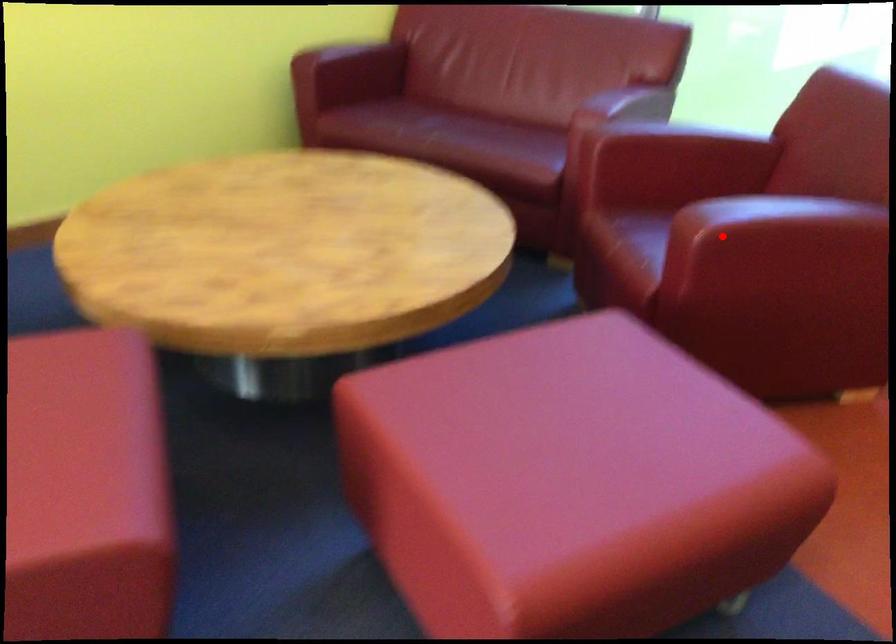
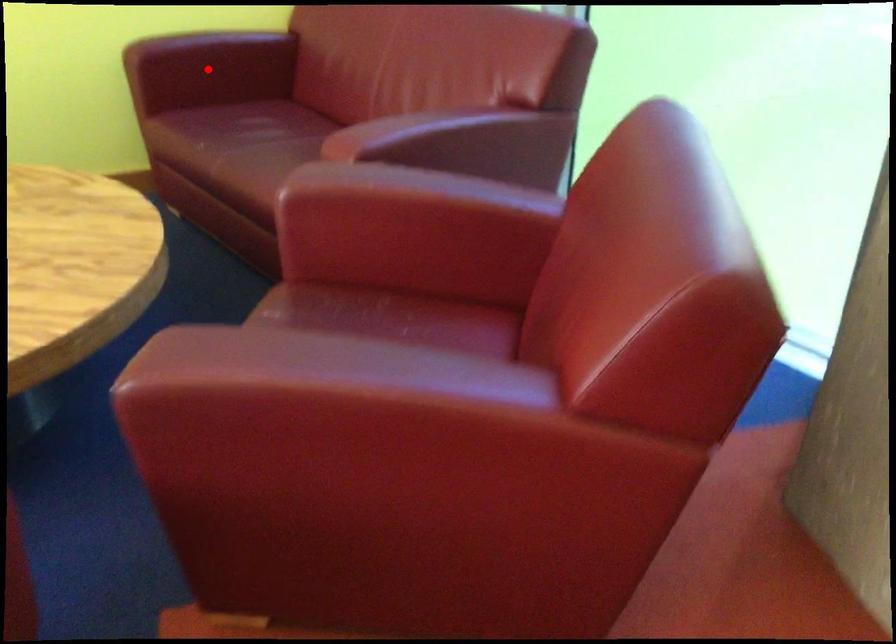
I am providing you with two images of the same scene from different viewpoints. A red point is marked on the first image and another point is marked on the second image. Is the marked point in image1 the same physical position as the marked point in image2?

No